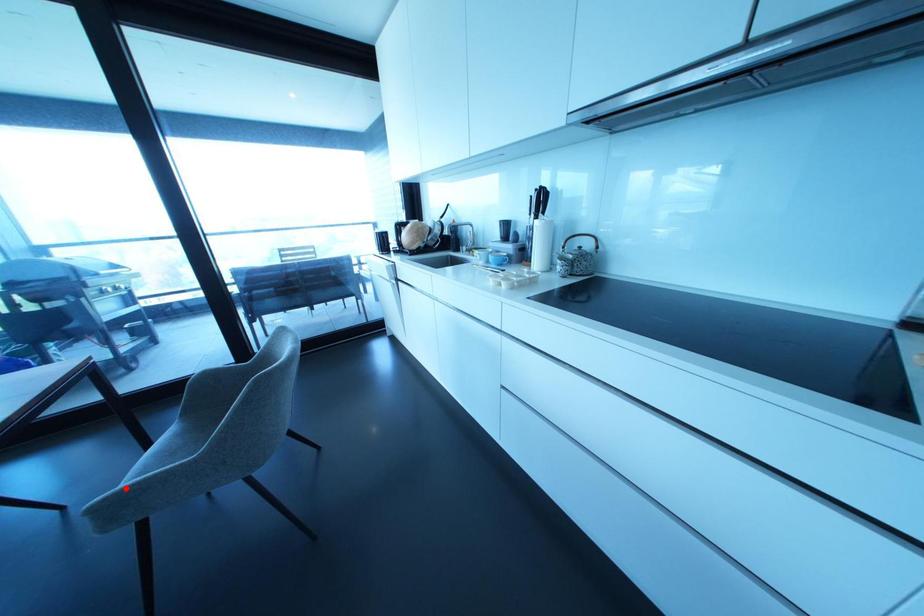
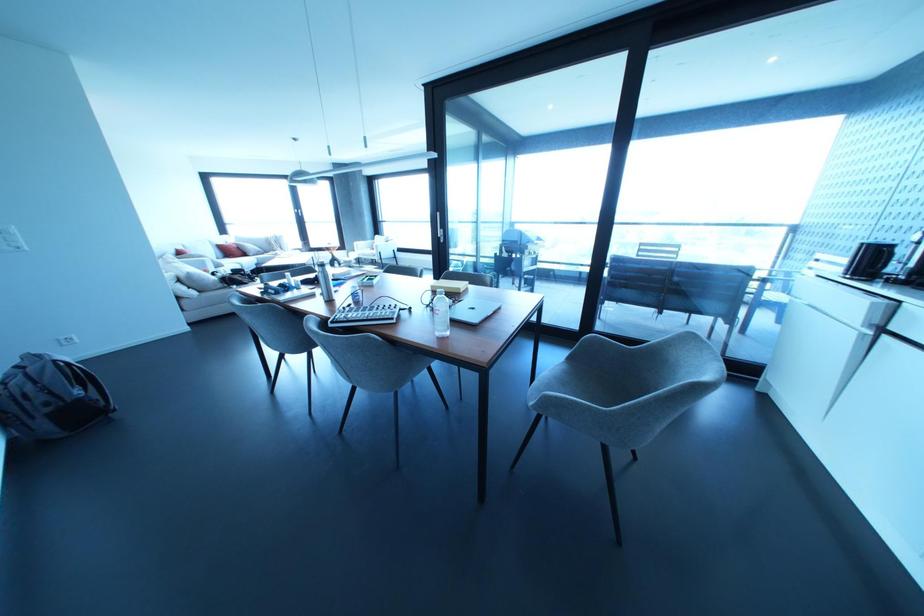
Question: I am providing you with two images of the same scene from different viewpoints. Given a red point in image1, look at the same physical point in image2. Is it:

Choices:
 (A) Closer to the viewpoint
 (B) Farther from the viewpoint

Answer: (B)